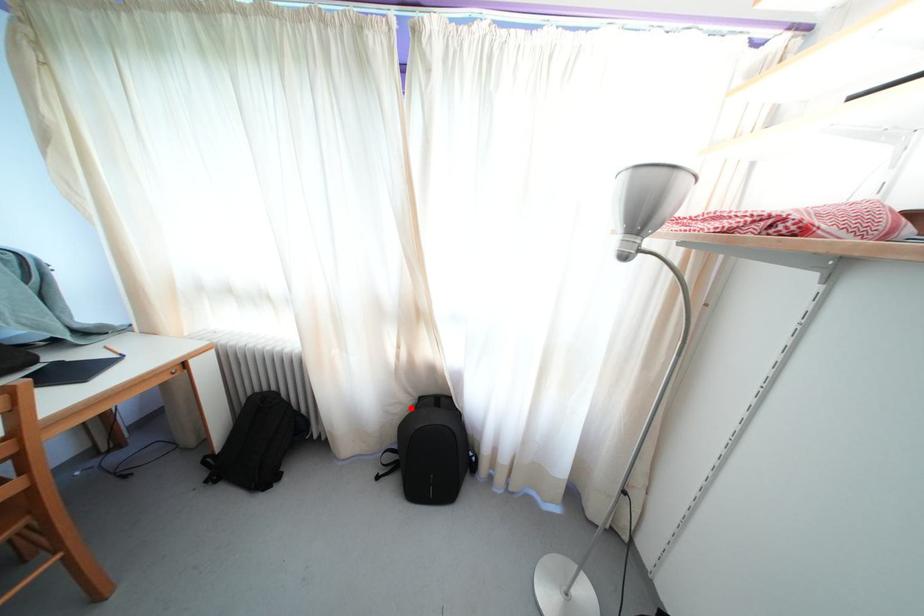
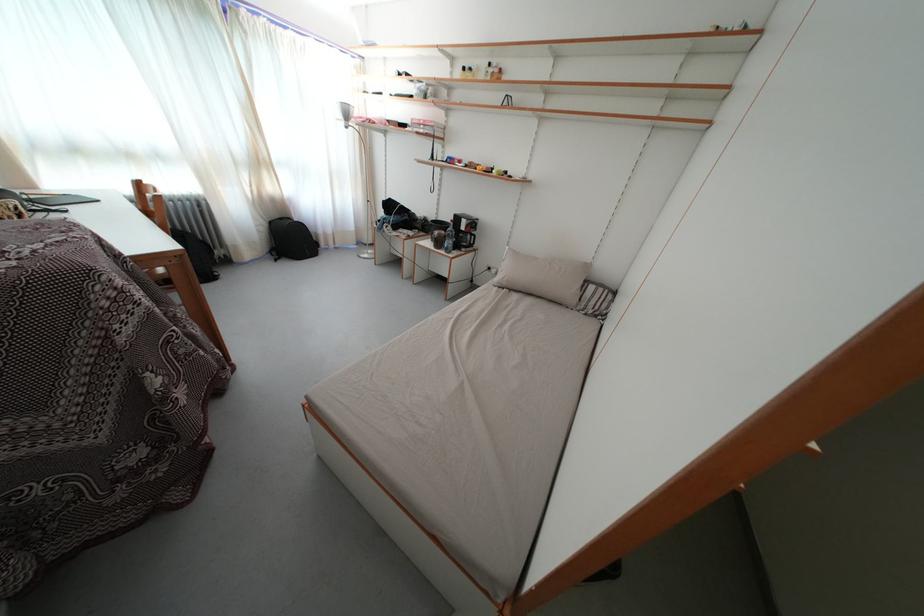
Question: I am providing you with two images of the same scene from different viewpoints. Image1 has a red point marked. In image2, the corresponding 3D location appears at what relative position? Reply with the corresponding letter.

Choices:
 (A) Closer
 (B) Farther

Answer: (A)